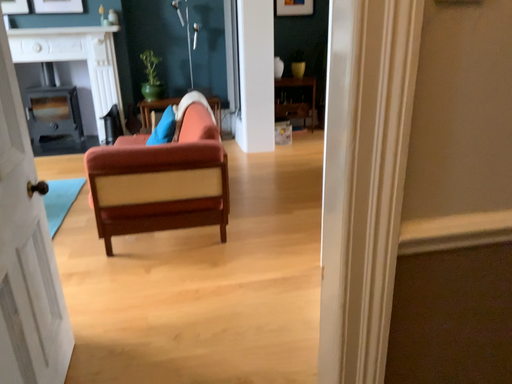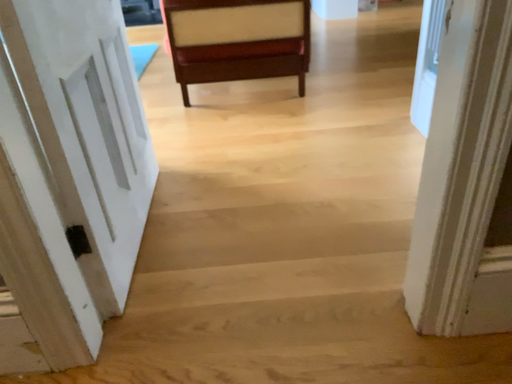
Question: How did the camera likely rotate when shooting the video?

Choices:
 (A) rotated downward
 (B) rotated upward

Answer: (A)